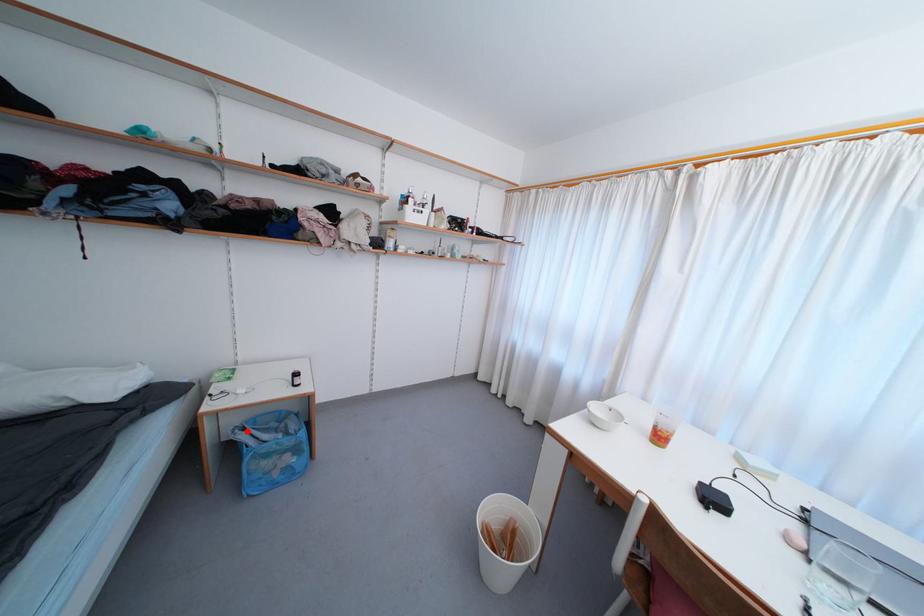
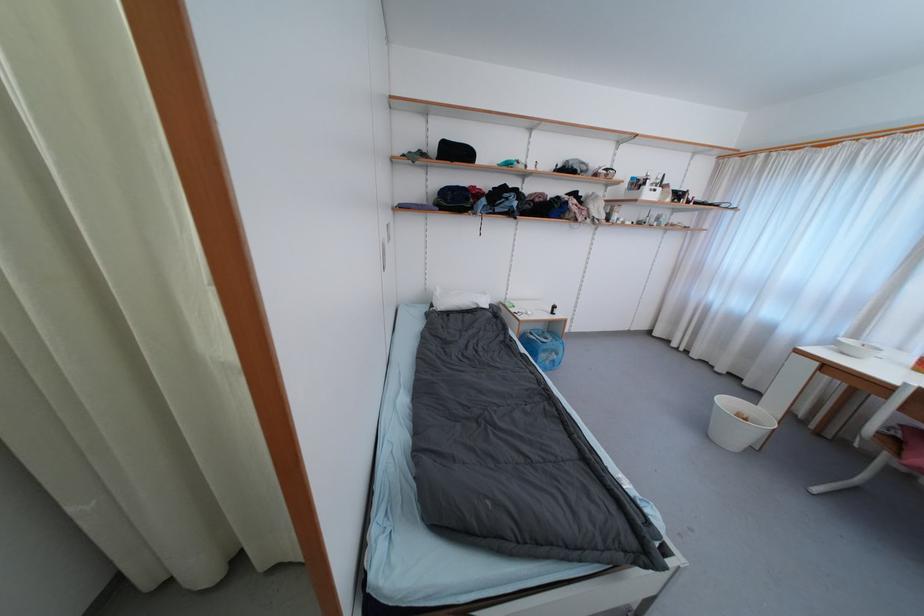
Question: I am providing you with two images of the same scene from different viewpoints. Given a red point in image1, look at the same physical point in image2. Is it:

Choices:
 (A) Closer to the viewpoint
 (B) Farther from the viewpoint

Answer: (B)